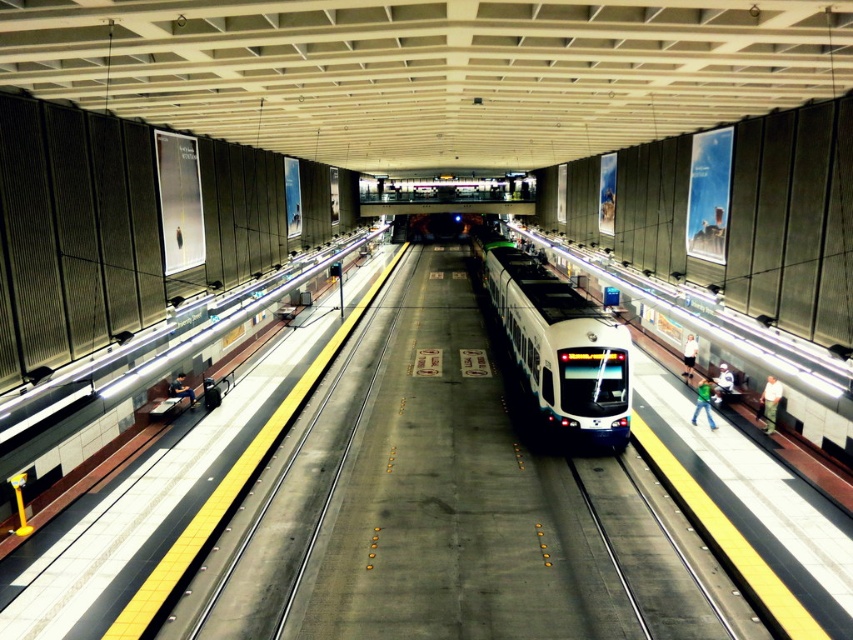
Question: Among these objects, which one is farthest from the camera?

Choices:
 (A) white cotton shirt at right
 (B) green fabric shirt at right
 (C) light blue shirt at right
 (D) white glossy train at center

Answer: (C)

Question: Is white glossy train at center smaller than light blue shirt at right?

Choices:
 (A) yes
 (B) no

Answer: (B)

Question: Among these points, which one is farthest from the camera?

Choices:
 (A) pos(189,404)
 (B) pos(686,376)

Answer: (B)

Question: Does green matte shirt at right appear over light blue shirt at right?

Choices:
 (A) yes
 (B) no

Answer: (B)

Question: Considering the relative positions of green matte shirt at right and green fabric shirt at right in the image provided, where is green matte shirt at right located with respect to green fabric shirt at right?

Choices:
 (A) right
 (B) left

Answer: (B)

Question: Which of the following is the farthest from the observer?

Choices:
 (A) green fabric shirt at right
 (B) white glossy train at center

Answer: (A)